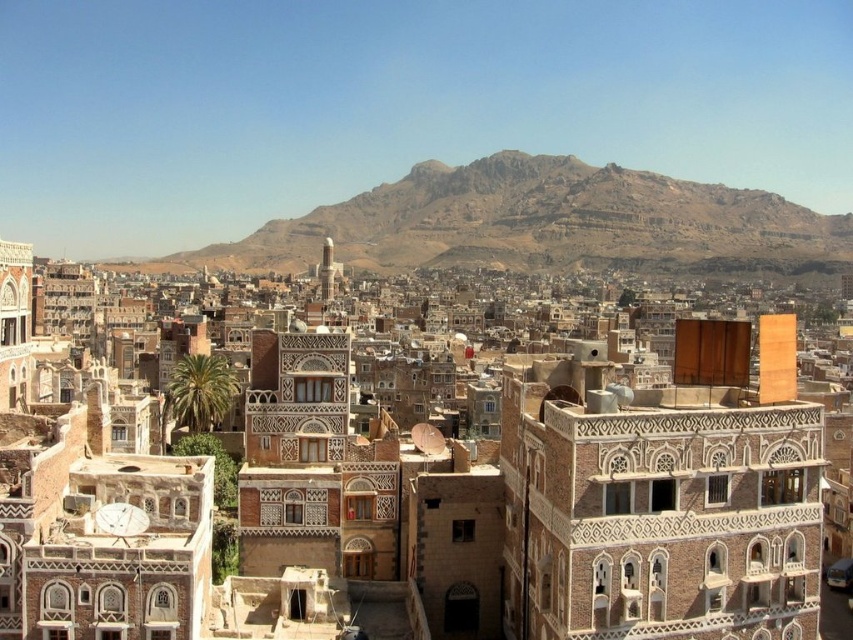
Does brown textured building at center appear on the right side of rugged brown rock formation at center?

No, brown textured building at center is not to the right of rugged brown rock formation at center.

Does brown textured building at center appear on the left side of rugged brown rock formation at center?

Yes, brown textured building at center is to the left of rugged brown rock formation at center.

Between point (490, 545) and point (532, 184), which one is positioned behind?

The point (532, 184) is more distant.

Where is `brown textured building at center`? The image size is (853, 640). brown textured building at center is located at coordinates (439, 502).